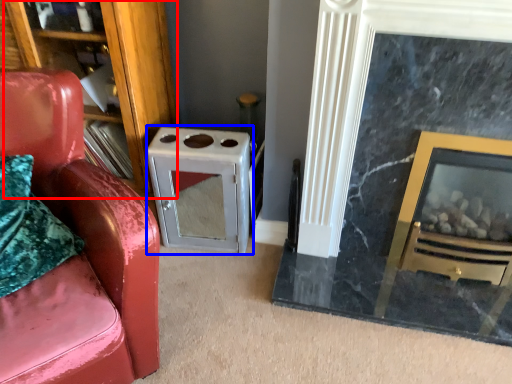
Question: Which point is further to the camera, bookshelf (highlighted by a red box) or appliance (highlighted by a blue box)?

Choices:
 (A) bookshelf
 (B) appliance

Answer: (B)